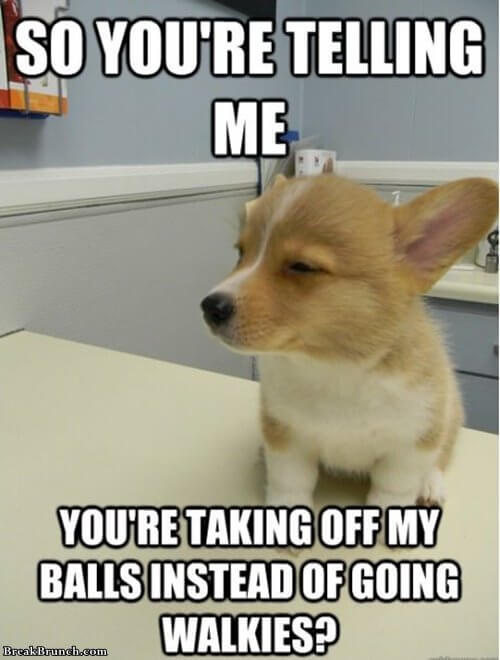
Find the location of a particular element. table is located at coordinates (155, 457).